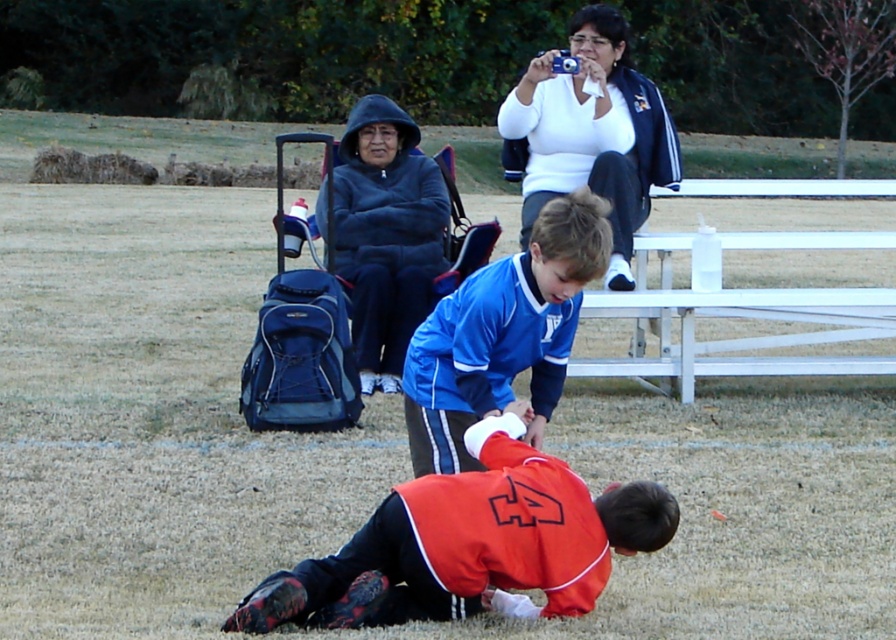
You are a referee standing at the center circle of the soccer field. You need to locate the orange jersey at lower center. Based on the coordinates provided, which direction should you move to find it?

The orange jersey at lower center is located at coordinates point (471, 545). Since the x coordinate is 0.852, which is closer to the right edge, and the y coordinate is 0.527, which is near the middle, you should move to the right from the center circle to find it.